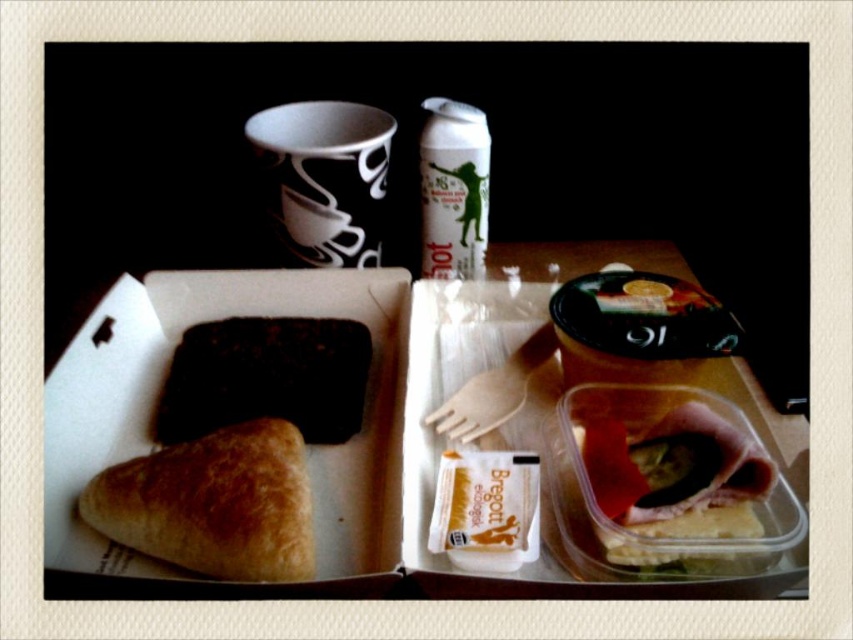
Does golden brown flaky croissant at lower left appear under dark chocolate bar at center?

Indeed, golden brown flaky croissant at lower left is positioned under dark chocolate bar at center.

Who is more forward, (177, 474) or (334, 348)?

Point (177, 474)

This screenshot has height=640, width=853. What do you see at coordinates (213, 502) in the screenshot?
I see `golden brown flaky croissant at lower left` at bounding box center [213, 502].

This screenshot has height=640, width=853. I want to click on golden brown flaky croissant at lower left, so click(213, 502).

Who is positioned more to the right, translucent plastic container at center or dark chocolate bar at center?

translucent plastic container at center

Can you confirm if translucent plastic container at center is positioned to the left of dark chocolate bar at center?

In fact, translucent plastic container at center is to the right of dark chocolate bar at center.

Does point (722, 518) come farther from viewer compared to point (238, 344)?

No, (722, 518) is closer to viewer.

Identify the location of translucent plastic container at center. This screenshot has height=640, width=853. (668, 472).

Who is taller, translucent plastic container at center or golden brown flaky croissant at lower left?

translucent plastic container at center is taller.

Find the location of a particular element. translucent plastic container at center is located at coordinates (668, 472).

Find the location of `translucent plastic container at center`. translucent plastic container at center is located at coordinates click(668, 472).